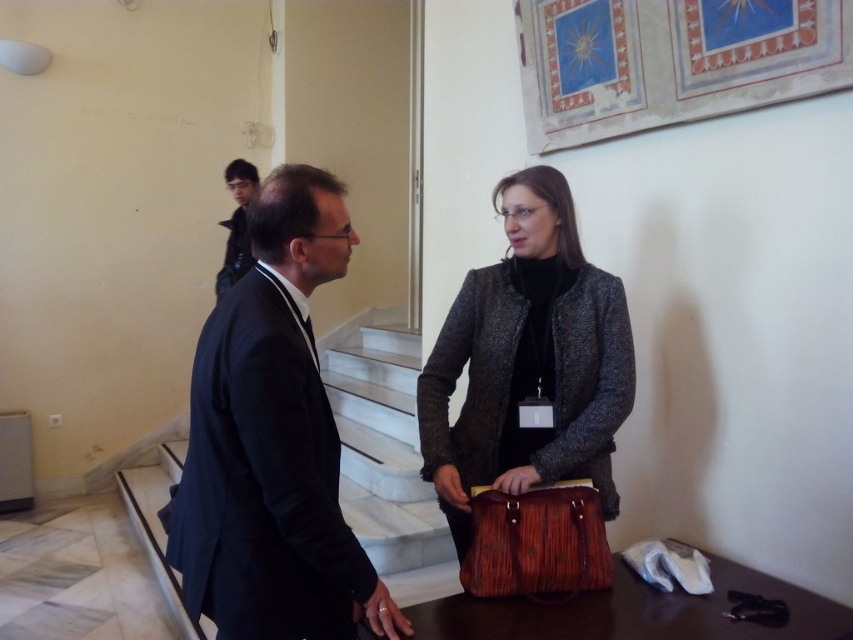
Can you confirm if textured gray coat at center is smaller than wooden briefcase at center?

Incorrect, textured gray coat at center is not smaller in size than wooden briefcase at center.

Does textured gray coat at center have a lesser height compared to wooden briefcase at center?

Incorrect, textured gray coat at center's height does not fall short of wooden briefcase at center's.

Where is `textured gray coat at center`? textured gray coat at center is located at coordinates (527, 362).

Is black suit at center further to camera compared to textured gray coat at center?

No, black suit at center is in front of textured gray coat at center.

Image resolution: width=853 pixels, height=640 pixels. Describe the element at coordinates (271, 442) in the screenshot. I see `black suit at center` at that location.

Image resolution: width=853 pixels, height=640 pixels. I want to click on black suit at center, so click(271, 442).

Between textured gray coat at center and black leather jacket at upper left, which one has more height?

With more height is textured gray coat at center.

Who is higher up, textured gray coat at center or black leather jacket at upper left?

black leather jacket at upper left

The width and height of the screenshot is (853, 640). Describe the element at coordinates (527, 362) in the screenshot. I see `textured gray coat at center` at that location.

Where is `textured gray coat at center`? The height and width of the screenshot is (640, 853). textured gray coat at center is located at coordinates pos(527,362).